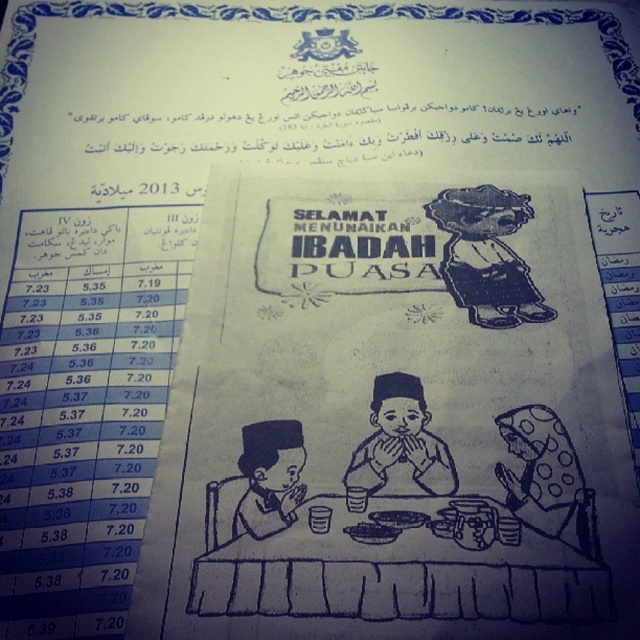
Based on the photo, you are an art student analyzing a historical document. You notice two black figures on the document. The first is a black paper doll at upper right, and the second is a black ink drawing of child at center. Which of these two figures is bigger in size?

Result: The black paper doll at upper right is larger in size compared to the black ink drawing of child at center.

You are looking at the document and want to compare the black paper table at center and the dark brown matte plate at center. Which one appears nearer to you?

The black paper table at center is closer to the viewer than the dark brown matte plate at center.